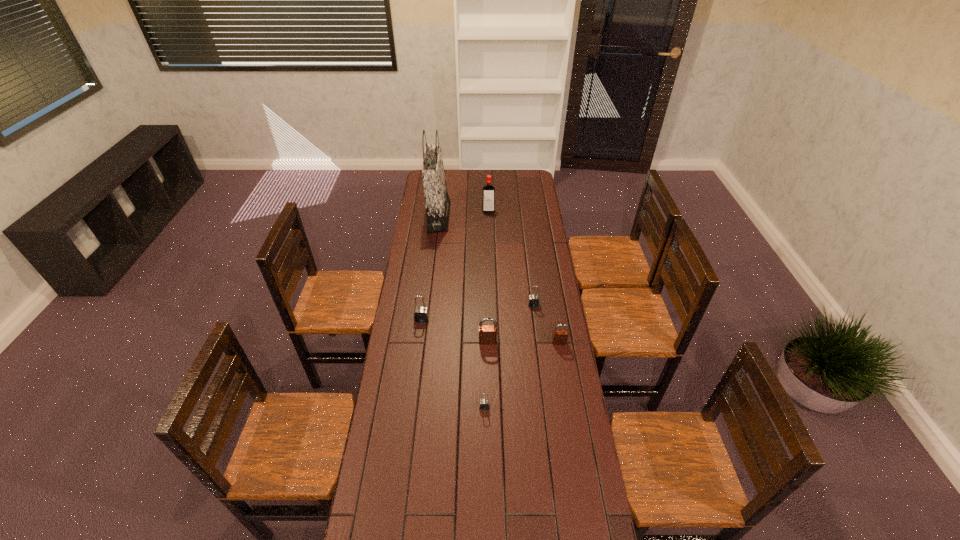
At what (x,y) coordinates should I click in order to perform the action: click on padlock present at the left edge. Please return your answer as a coordinate pair (x, y). Looking at the image, I should click on (421, 314).

Locate an element on the screen. blank area at the far edge is located at coordinates (506, 176).

Find the location of a particular element. The width and height of the screenshot is (960, 540). free location at the left edge of the desktop is located at coordinates (398, 356).

At what (x,y) coordinates should I click in order to perform the action: click on free space at the right edge of the desktop. Please return your answer as a coordinate pair (x, y). The width and height of the screenshot is (960, 540). Looking at the image, I should click on (547, 290).

I want to click on empty space that is in between the shopping bag and the sixth object from left to right, so click(x=486, y=261).

The image size is (960, 540). What are the coordinates of `vacant point located between the farthest padlock and the nearest object` in the screenshot? It's located at (509, 356).

Identify the location of free space between the leftmost padlock and the nearest padlock. This screenshot has height=540, width=960. (453, 363).

The image size is (960, 540). Identify the location of empty location between the tallest object and the rightmost padlock. (499, 280).

Where is `vacant space in between the rightmost object and the shortest padlock`? The image size is (960, 540). vacant space in between the rightmost object and the shortest padlock is located at coordinates (522, 375).

Where is `empty space that is in between the shopping bag and the leftmost gray padlock`? empty space that is in between the shopping bag and the leftmost gray padlock is located at coordinates (430, 268).